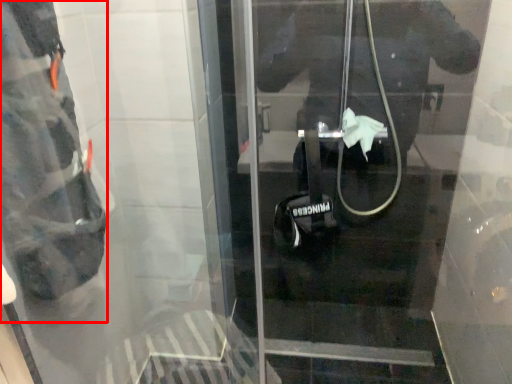
Question: From the image's perspective, where is wide (annotated by the red box) located in relation to door in the image?

Choices:
 (A) above
 (B) below

Answer: (A)